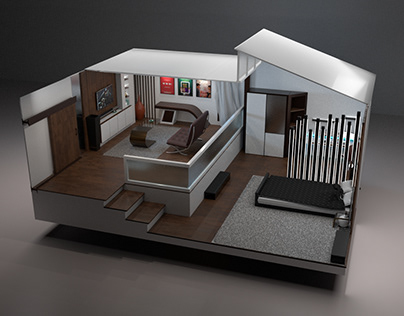
You are a GUI agent. You are given a task and a screenshot of the screen. Output one action in this format:
    pyautogui.click(x=<x>, y=<y>)
    Task: Click on the items on vertical small shelves on the right side of the tv
    The image size is (404, 316).
    Given the screenshot: What is the action you would take?
    coord(125,76), coord(126,86), coord(127,95), coord(128,101)